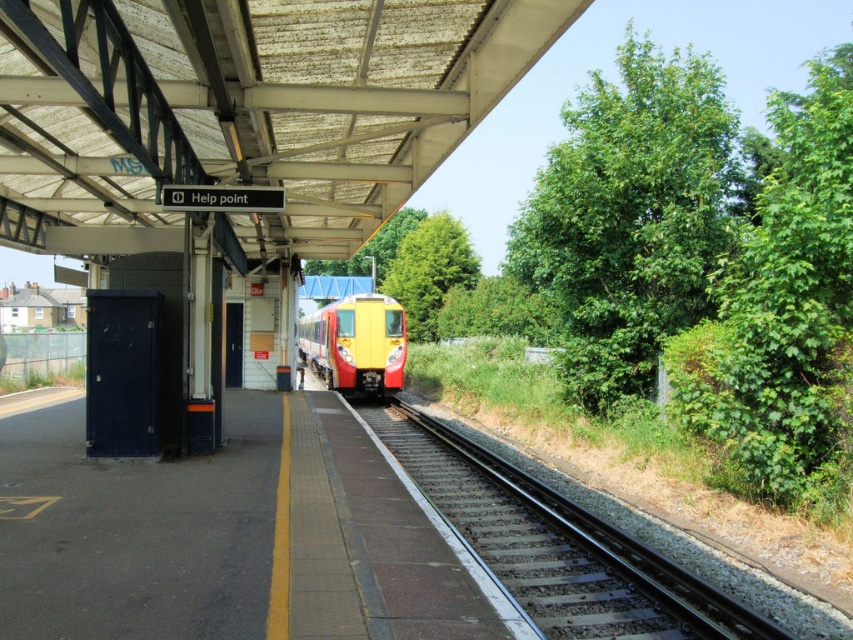
You are standing on the train station platform and want to board the train. Where should you position yourself relative to the smooth metal train track at center to ensure you are in the correct boarding area?

To board the train, you should position yourself near the smooth metal train track at center, which is located at coordinates approximately 0.853 on the x axis and 0.655 on the y axis.

You are standing on the train station platform and see the smooth metal train track at center and the yellow matte train at center. Which object is nearer to you?

The smooth metal train track at center is closer to the viewer than the yellow matte train at center.